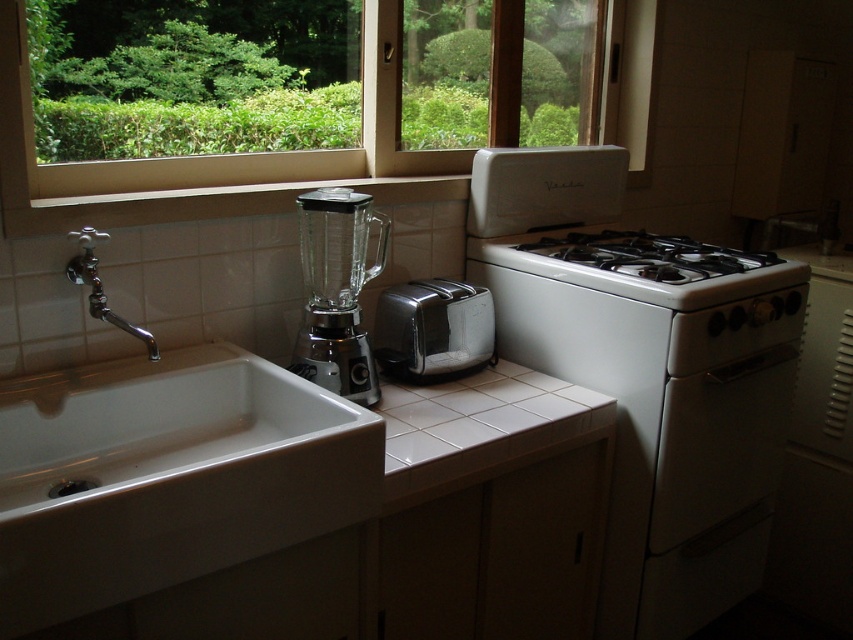
Does point (550, 365) come in front of point (706, 268)?

No, (550, 365) is further to viewer.

Is white glossy oven at right taller than white glossy gas stove at right?

Yes, white glossy oven at right is taller than white glossy gas stove at right.

The image size is (853, 640). What do you see at coordinates (663, 401) in the screenshot?
I see `white glossy oven at right` at bounding box center [663, 401].

Locate an element on the screen. The image size is (853, 640). white glossy oven at right is located at coordinates (663, 401).

Consider the image. Does transparent glass window at upper center lie in front of white glossy gas stove at right?

Yes, it is in front of white glossy gas stove at right.

Is transparent glass window at upper center taller than white glossy gas stove at right?

Yes.

What do you see at coordinates (219, 154) in the screenshot? The width and height of the screenshot is (853, 640). I see `transparent glass window at upper center` at bounding box center [219, 154].

Locate an element on the screen. The width and height of the screenshot is (853, 640). transparent glass window at upper center is located at coordinates (219, 154).

Does white glossy oven at right have a lesser height compared to transparent glass blender at center?

No, white glossy oven at right is not shorter than transparent glass blender at center.

Is white glossy oven at right bigger than transparent glass blender at center?

Yes.

The height and width of the screenshot is (640, 853). What are the coordinates of `white glossy oven at right` in the screenshot? It's located at (663, 401).